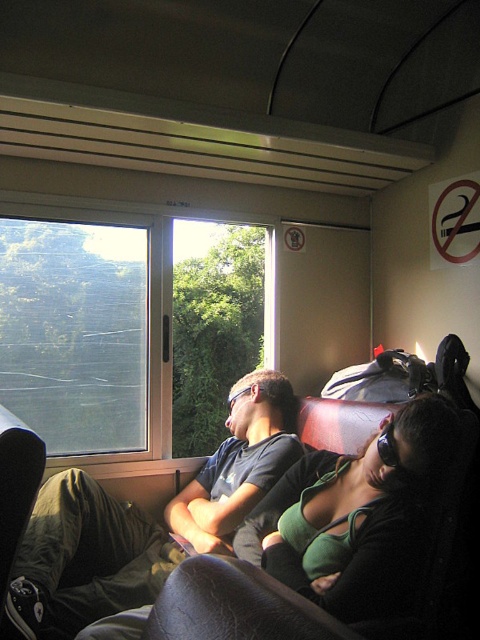
Question: Which object is positioned closest to the matte black shirt at left?

Choices:
 (A) transparent glass window at upper left
 (B) green fabric top at center

Answer: (B)

Question: Is matte black shirt at left below transparent glass window at upper left?

Choices:
 (A) no
 (B) yes

Answer: (B)

Question: Does transparent glass window at upper left appear under green fabric top at center?

Choices:
 (A) no
 (B) yes

Answer: (A)

Question: Estimate the real-world distances between objects in this image. Which object is closer to the matte black shirt at left?

Choices:
 (A) transparent glass window at upper left
 (B) green fabric top at center

Answer: (B)

Question: Does matte black shirt at left appear over transparent glass window at upper left?

Choices:
 (A) no
 (B) yes

Answer: (A)

Question: Among these points, which one is nearest to the camera?

Choices:
 (A) (132, 518)
 (B) (399, 464)

Answer: (B)